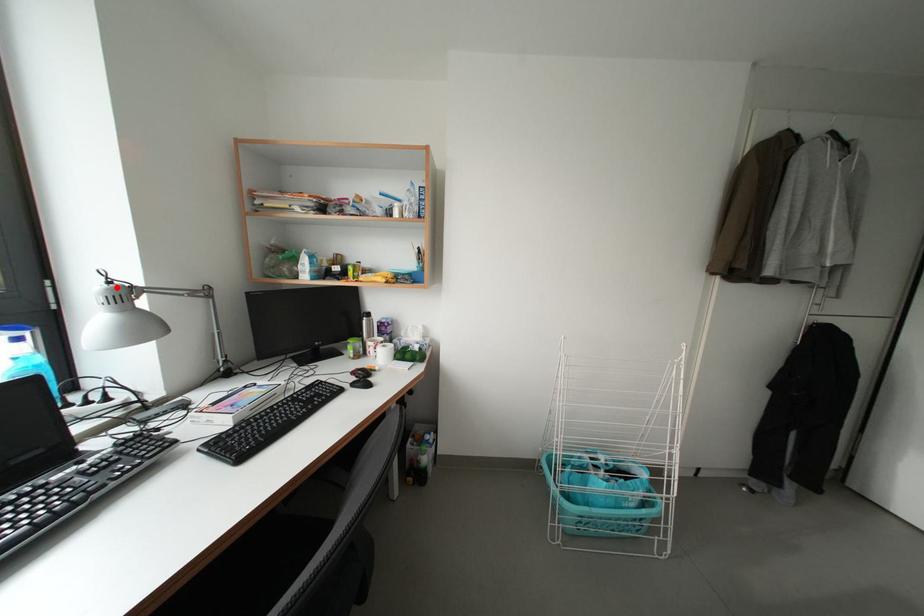
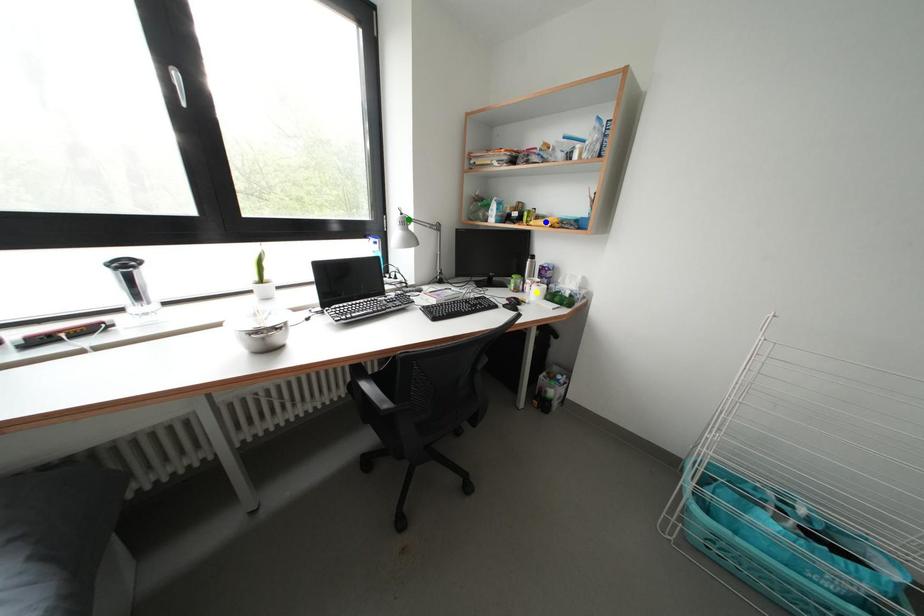
Question: I am providing you with two images of the same scene from different viewpoints. A red point is marked on the first image. You are given multiple points on the second image. In image 2, which mark is for the same physical point as the one in image 1?

Choices:
 (A) yellow point
 (B) blue point
 (C) green point

Answer: (C)